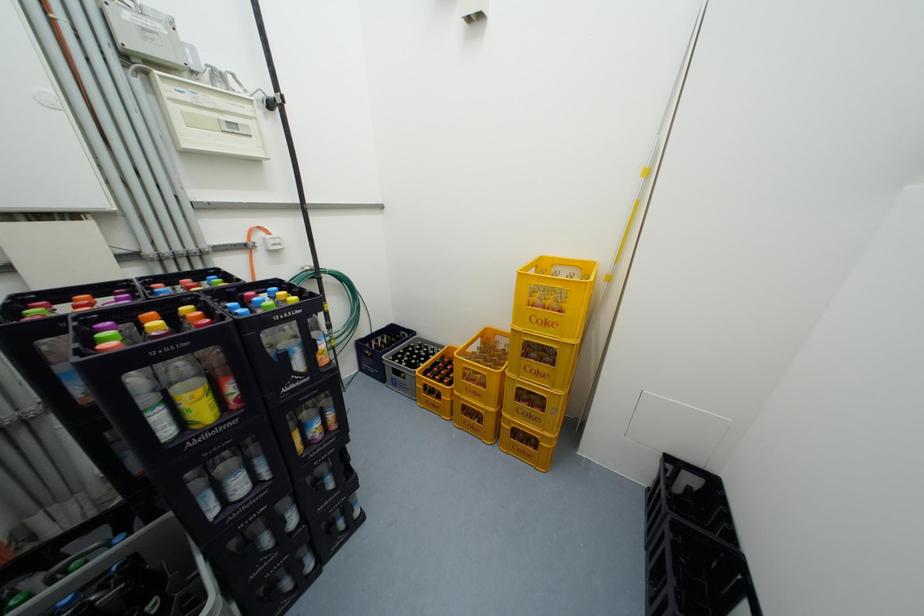
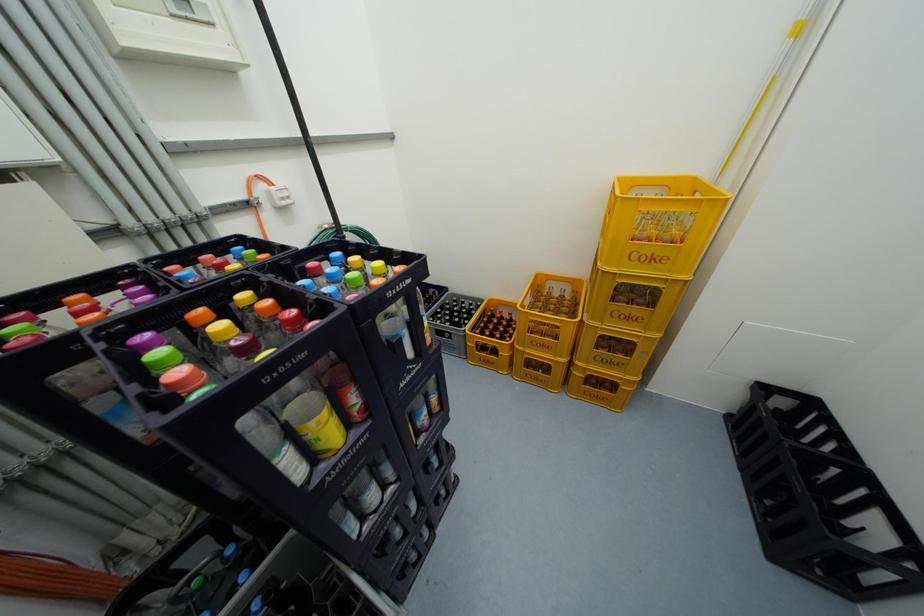
Question: Based on the continuous images, in which direction is the camera rotating? Reply with the corresponding letter.

Choices:
 (A) Left
 (B) Right
 (C) Up
 (D) Down

Answer: (D)